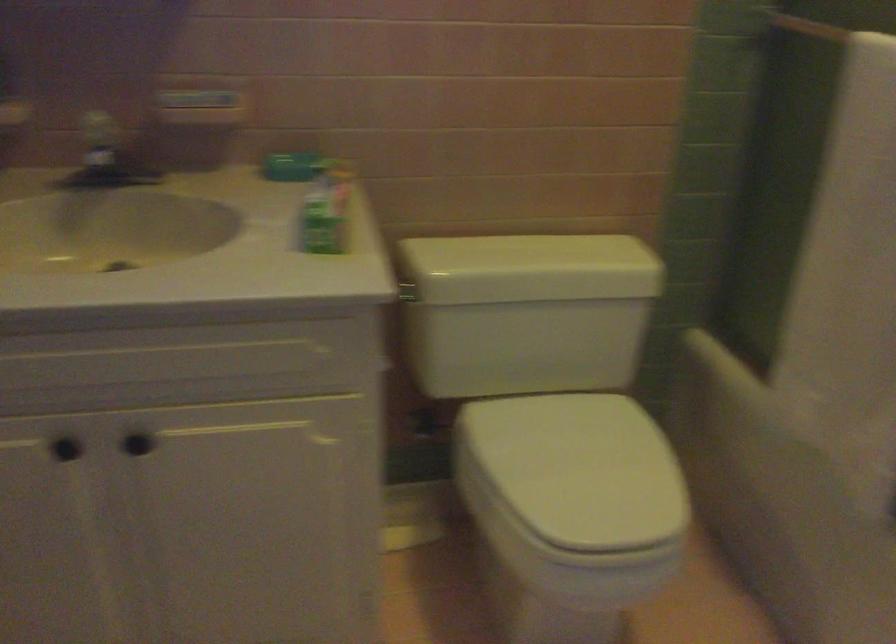
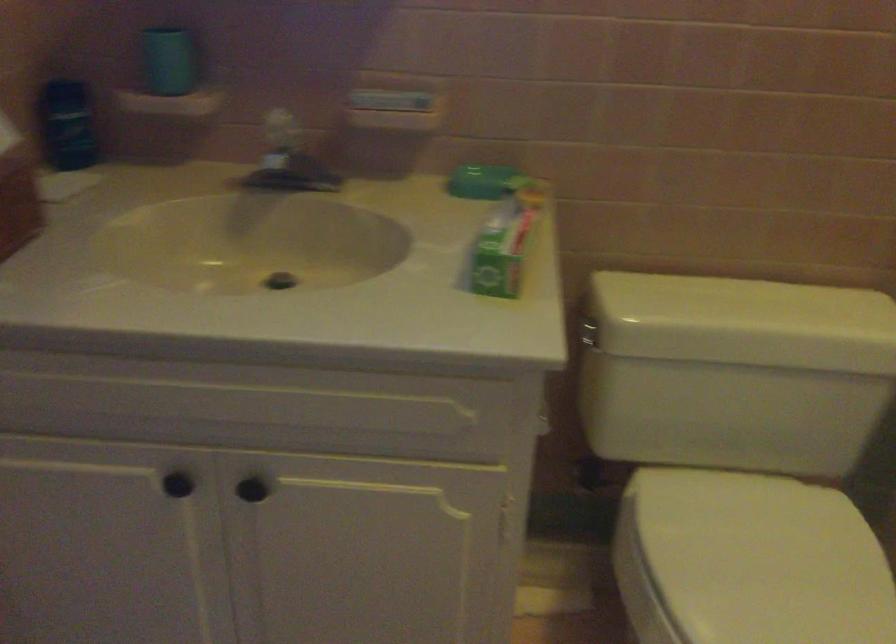
Question: In a continuous first-person perspective shot, in which direction is the camera moving?

Choices:
 (A) Left
 (B) Right
 (C) Forward
 (D) Backward

Answer: (C)